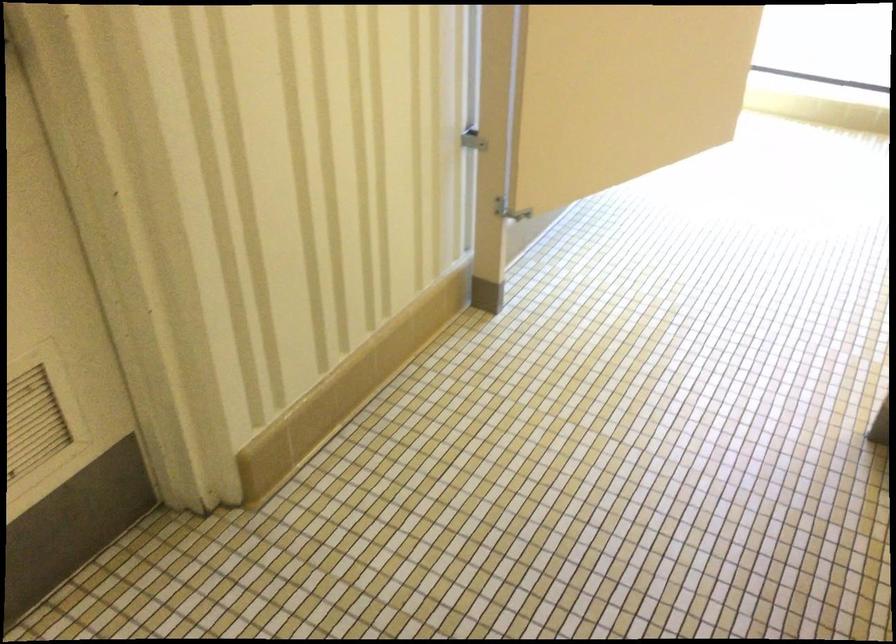
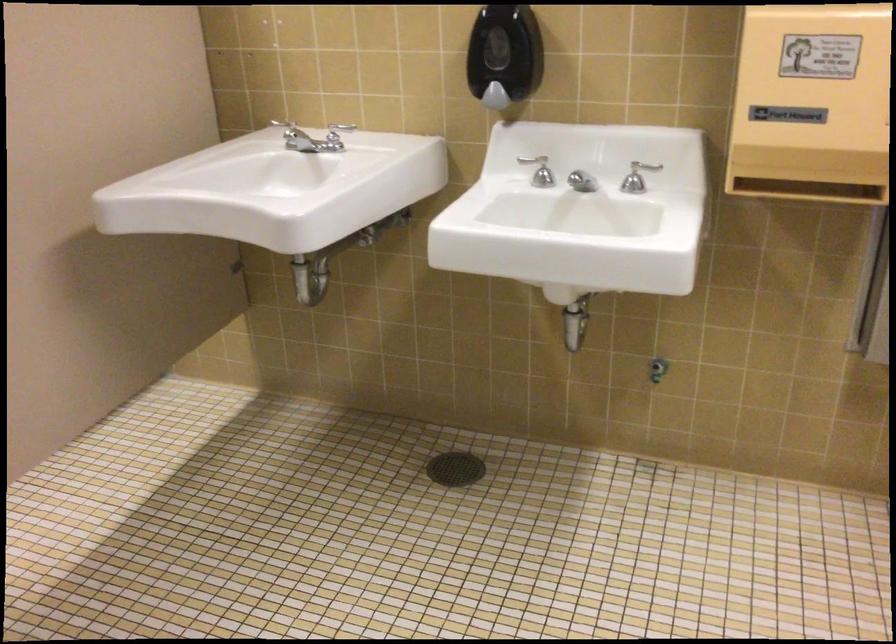
Based on the continuous images, in which direction is the camera rotating?

The camera's rotation is toward right-down.